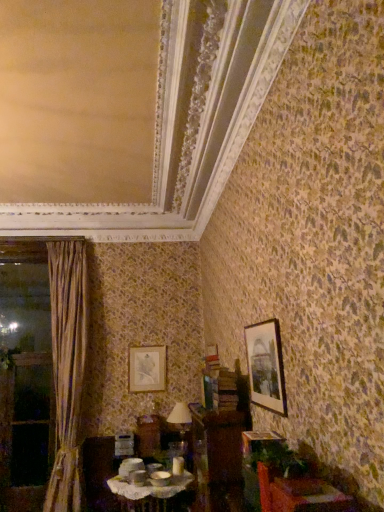
Question: Considering the relative sizes of wooden window frame at left and brown wooden dresser at center in the image provided, is wooden window frame at left wider than brown wooden dresser at center?

Choices:
 (A) no
 (B) yes

Answer: (A)

Question: Is the depth of wooden window frame at left greater than that of brown wooden dresser at center?

Choices:
 (A) yes
 (B) no

Answer: (A)

Question: From a real-world perspective, is wooden window frame at left on brown wooden dresser at center?

Choices:
 (A) no
 (B) yes

Answer: (B)

Question: Is wooden window frame at left taller than brown wooden dresser at center?

Choices:
 (A) no
 (B) yes

Answer: (B)

Question: From a real-world perspective, is wooden window frame at left physically below brown wooden dresser at center?

Choices:
 (A) no
 (B) yes

Answer: (A)

Question: Is silky beige curtain at left to the left or to the right of matte ceramic bowls at center, which is the first table in left-to-right order, in the image?

Choices:
 (A) right
 (B) left

Answer: (B)

Question: From the image's perspective, relative to matte ceramic bowls at center, which is counted as the 1th table, starting from the back, is silky beige curtain at left above or below?

Choices:
 (A) below
 (B) above

Answer: (B)

Question: Considering their positions, is silky beige curtain at left located in front of or behind matte ceramic bowls at center, which is counted as the 1th table, starting from the back?

Choices:
 (A) front
 (B) behind

Answer: (B)

Question: Considering the positions of point (56, 320) and point (147, 482), is point (56, 320) closer or farther from the camera than point (147, 482)?

Choices:
 (A) closer
 (B) farther

Answer: (B)

Question: Is matte silver picture frame at center, positioned as the 2th picture frame in right-to-left order, taller or shorter than matte white lampshade at center?

Choices:
 (A) short
 (B) tall

Answer: (B)

Question: Relative to matte white lampshade at center, is matte silver picture frame at center, positioned as the 2th picture frame in right-to-left order, in front or behind?

Choices:
 (A) front
 (B) behind

Answer: (B)

Question: Visually, is matte silver picture frame at center, the first picture frame when ordered from left to right, positioned to the left or to the right of matte white lampshade at center?

Choices:
 (A) left
 (B) right

Answer: (A)

Question: Would you say matte silver picture frame at center, acting as the first picture frame starting from the back, is inside or outside matte white lampshade at center?

Choices:
 (A) inside
 (B) outside

Answer: (B)

Question: From the image's perspective, is wooden window frame at left located above or below brown wooden dresser at center?

Choices:
 (A) above
 (B) below

Answer: (B)

Question: From a real-world perspective, is wooden window frame at left physically located above or below brown wooden dresser at center?

Choices:
 (A) below
 (B) above

Answer: (B)